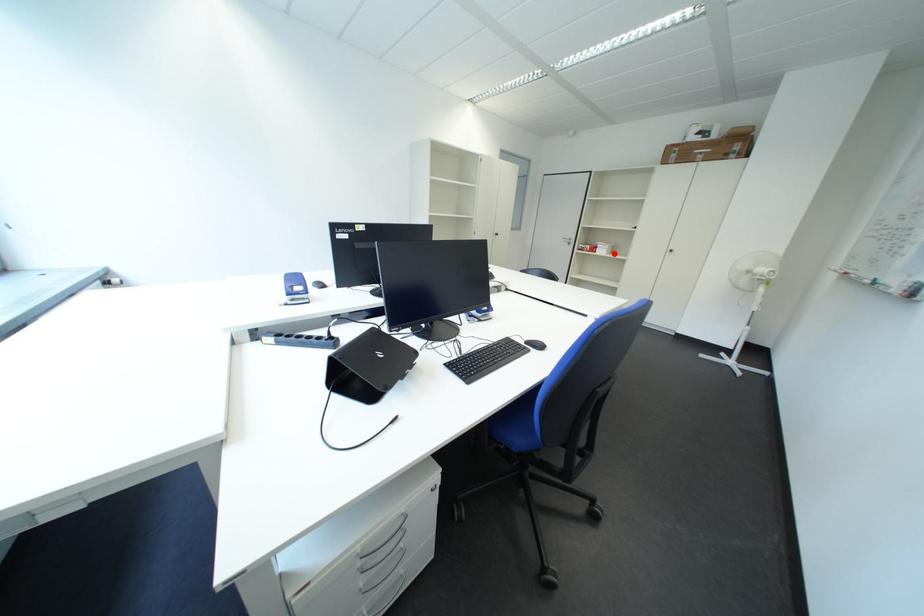
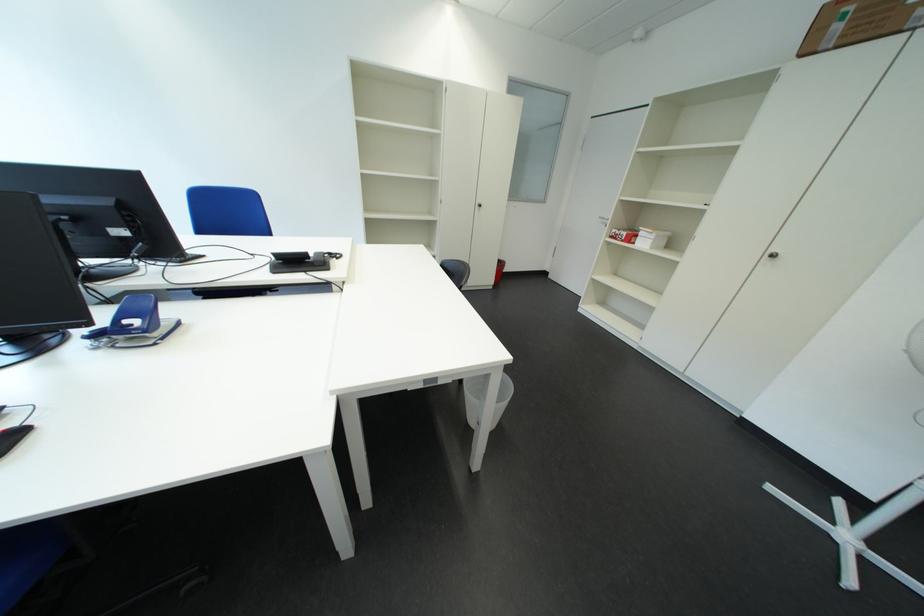
Where in the second image is the point corresponding to the highlighted location from the first image?

(657, 246)